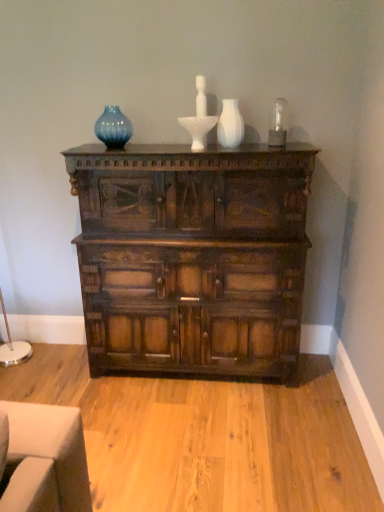
Question: Does white matte vase at center appear on the right side of blue glass vase at upper center?

Choices:
 (A) no
 (B) yes

Answer: (B)

Question: Considering the relative positions of white matte vase at center and blue glass vase at upper center in the image provided, is white matte vase at center to the left of blue glass vase at upper center from the viewer's perspective?

Choices:
 (A) yes
 (B) no

Answer: (B)

Question: Considering the relative sizes of white matte vase at center and blue glass vase at upper center in the image provided, is white matte vase at center thinner than blue glass vase at upper center?

Choices:
 (A) yes
 (B) no

Answer: (B)

Question: From a real-world perspective, is white matte vase at center beneath blue glass vase at upper center?

Choices:
 (A) no
 (B) yes

Answer: (B)

Question: Is white matte vase at center facing towards blue glass vase at upper center?

Choices:
 (A) yes
 (B) no

Answer: (B)

Question: From the image's perspective, is white matte vase at center located beneath blue glass vase at upper center?

Choices:
 (A) no
 (B) yes

Answer: (B)

Question: Does dark wood chest of drawers at center appear on the right side of white matte vase at center?

Choices:
 (A) yes
 (B) no

Answer: (B)

Question: Is dark wood chest of drawers at center oriented away from white matte vase at center?

Choices:
 (A) no
 (B) yes

Answer: (A)

Question: Considering the relative sizes of dark wood chest of drawers at center and white matte vase at center in the image provided, is dark wood chest of drawers at center bigger than white matte vase at center?

Choices:
 (A) no
 (B) yes

Answer: (B)

Question: Is dark wood chest of drawers at center to the left of white matte vase at center from the viewer's perspective?

Choices:
 (A) no
 (B) yes

Answer: (B)

Question: Is dark wood chest of drawers at center with white matte vase at center?

Choices:
 (A) no
 (B) yes

Answer: (A)

Question: Is dark wood chest of drawers at center oriented towards white matte vase at center?

Choices:
 (A) no
 (B) yes

Answer: (A)

Question: From the image's perspective, is blue glass vase at upper center located beneath dark wood chest of drawers at center?

Choices:
 (A) no
 (B) yes

Answer: (A)